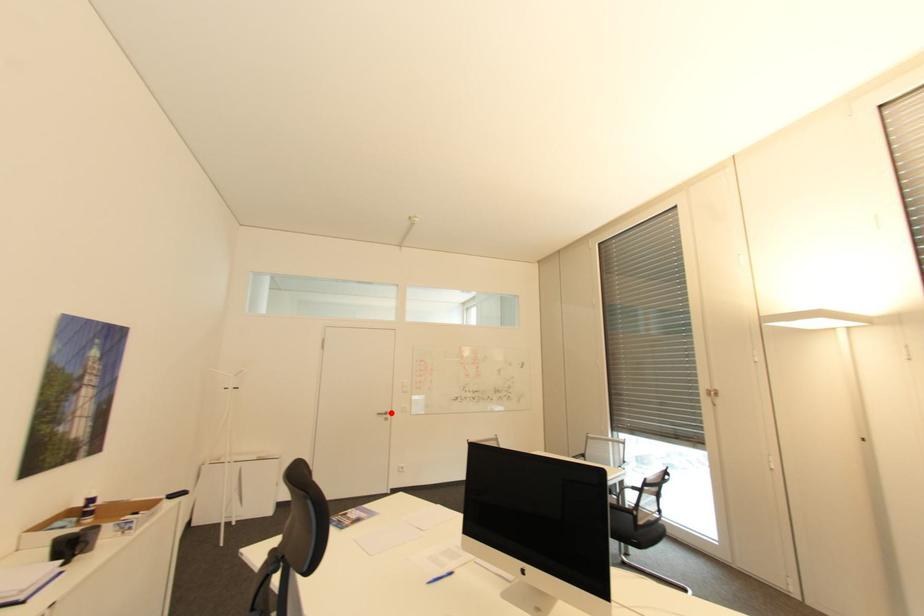
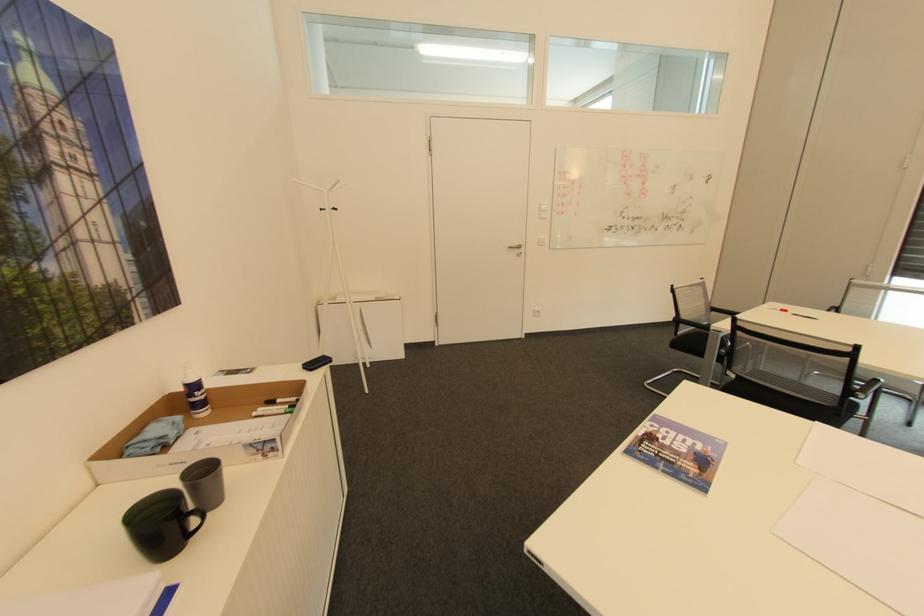
Question: I am providing you with two images of the same scene from different viewpoints. Image1 has a red point marked. In image2, the corresponding 3D location appears at what relative position? Reply with the corresponding letter.

Choices:
 (A) Closer
 (B) Farther

Answer: (A)